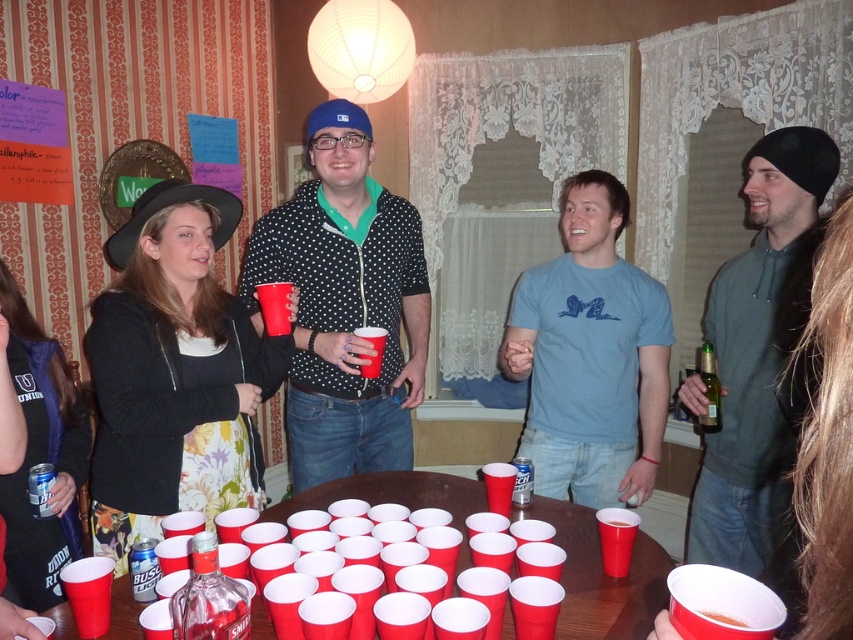
Question: Does polka dot shirt at center have a larger size compared to gray hoodie at right?

Choices:
 (A) yes
 (B) no

Answer: (A)

Question: Does polka dot shirt at center appear over clear glass bottle at lower left?

Choices:
 (A) no
 (B) yes

Answer: (B)

Question: Which of the following is the farthest from the observer?

Choices:
 (A) (347, 493)
 (B) (196, 634)
 (C) (325, 404)

Answer: (C)

Question: Where is light blue cotton t-shirt at center located in relation to smooth plastic cups at center in the image?

Choices:
 (A) left
 (B) right

Answer: (B)

Question: Which of the following is the farthest from the observer?

Choices:
 (A) (421, 474)
 (B) (601, 468)
 (C) (758, 429)

Answer: (B)

Question: Which object is positioned closest to the polka dot shirt at center?

Choices:
 (A) clear glass bottle at lower left
 (B) gray hoodie at right

Answer: (B)